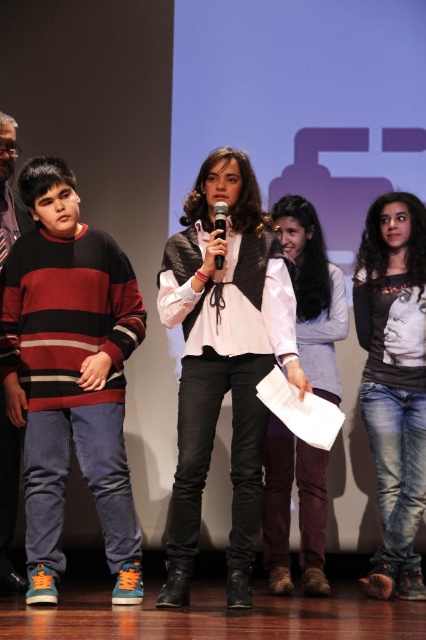
Is white matte vest at center to the right of black plastic microphone at center from the viewer's perspective?

Correct, you'll find white matte vest at center to the right of black plastic microphone at center.

Which is behind, point (250, 285) or point (222, 232)?

Point (250, 285)

You are a GUI agent. You are given a task and a screenshot of the screen. Output one action in this format:
    pyautogui.click(x=<x>, y=<y>)
    Task: Click on the white matte vest at center
    
    Given the screenshot: What is the action you would take?
    pyautogui.click(x=224, y=360)

Where is `black matte shirt at right`? The image size is (426, 640). black matte shirt at right is located at coordinates (394, 381).

Which is in front, point (422, 589) or point (322, 468)?

Positioned in front is point (422, 589).

I want to click on black matte shirt at right, so click(394, 381).

Who is higher up, striped sweater at left or white matte vest at center?

white matte vest at center is higher up.

Does point (2, 310) come behind point (273, 355)?

That is True.

Which is behind, point (62, 336) or point (247, 259)?

The point (247, 259) is more distant.

Image resolution: width=426 pixels, height=640 pixels. I want to click on striped sweater at left, so click(69, 376).